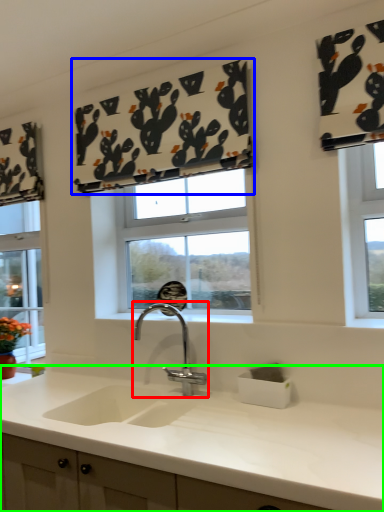
Question: Which object is positioned closest to tap (highlighted by a red box)? Select from curtain (highlighted by a blue box) and countertop (highlighted by a green box).

Choices:
 (A) curtain
 (B) countertop

Answer: (B)